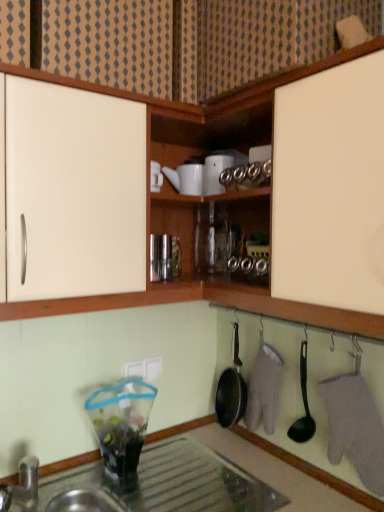
Question: From a real-world perspective, is metallic glass jar at center, which is the third appliance in top-to-bottom order, positioned above or below black plastic spoon at lower center?

Choices:
 (A) below
 (B) above

Answer: (B)

Question: Is point (170, 272) positioned closer to the camera than point (301, 339)?

Choices:
 (A) closer
 (B) farther

Answer: (A)

Question: Which of these objects is positioned closest to the black plastic spoon at lower center?

Choices:
 (A) transparent glass countertop at lower left
 (B) white matte teapot at upper center, which is counted as the 3th appliance, starting from the bottom
 (C) clear plastic bag at lower left, the first appliance ordered from the bottom
 (D) white matte cabinet at upper center
 (E) metallic glass jar at center, which appears as the second appliance when ordered from the bottom

Answer: (A)

Question: Estimate the real-world distances between objects in this image. Which object is farther from the clear plastic bag at lower left, marked as the 4th appliance in a top-to-bottom arrangement?

Choices:
 (A) white plastic electric outlet at lower center
 (B) black plastic spoon at lower center
 (C) white glossy teapot at upper center, which ranks as the first appliance in top-to-bottom order
 (D) metallic glass jar at center, which appears as the second appliance when ordered from the bottom
 (E) white matte cabinet at upper center

Answer: (E)